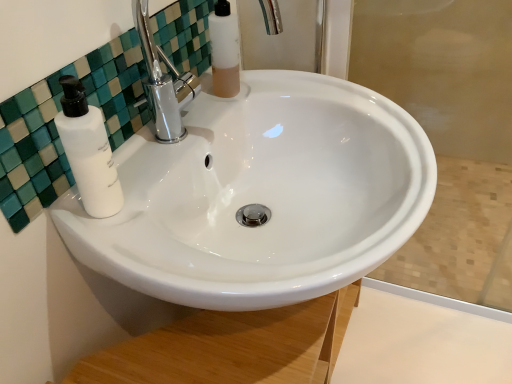
Image resolution: width=512 pixels, height=384 pixels. What do you see at coordinates (261, 195) in the screenshot?
I see `white glossy sink at center` at bounding box center [261, 195].

This screenshot has width=512, height=384. Identify the location of white matte soap dispenser at left. (88, 151).

From a real-world perspective, is white glossy sink at center over white glossy sink at upper center?

No.

Who is shorter, white glossy sink at center or white glossy sink at upper center?

white glossy sink at upper center.

Is white glossy sink at center in front of white glossy sink at upper center?

Yes, white glossy sink at center is closer to the viewer.

Based on the photo, from the image's perspective, is white glossy sink at upper center above translucent plastic mouthwash at upper center?

Actually, white glossy sink at upper center appears below translucent plastic mouthwash at upper center in the image.

Considering the sizes of objects white glossy sink at upper center and translucent plastic mouthwash at upper center in the image provided, who is bigger, white glossy sink at upper center or translucent plastic mouthwash at upper center?

white glossy sink at upper center.

Who is shorter, white glossy sink at upper center or translucent plastic mouthwash at upper center?

white glossy sink at upper center.

Considering the relative sizes of white glossy sink at upper center and translucent plastic mouthwash at upper center in the image provided, is white glossy sink at upper center thinner than translucent plastic mouthwash at upper center?

Yes, white glossy sink at upper center is thinner than translucent plastic mouthwash at upper center.

Does white glossy sink at center have a greater width compared to translucent plastic mouthwash at upper center?

Indeed, white glossy sink at center has a greater width compared to translucent plastic mouthwash at upper center.

In the scene shown: From the image's perspective, is white glossy sink at center under translucent plastic mouthwash at upper center?

Indeed, from the image's perspective, white glossy sink at center is shown beneath translucent plastic mouthwash at upper center.

Considering the relative sizes of white glossy sink at center and translucent plastic mouthwash at upper center in the image provided, is white glossy sink at center taller than translucent plastic mouthwash at upper center?

Correct, white glossy sink at center is much taller as translucent plastic mouthwash at upper center.

Identify the location of soap dispenser behind the white glossy sink at upper center. (88, 151).

From the image's perspective, is white glossy sink at upper center located above white matte soap dispenser at left?

Indeed, from the image's perspective, white glossy sink at upper center is shown above white matte soap dispenser at left.

Considering the sizes of white glossy sink at upper center and white matte soap dispenser at left in the image, is white glossy sink at upper center bigger or smaller than white matte soap dispenser at left?

white glossy sink at upper center is bigger than white matte soap dispenser at left.

Is point (133, 66) in front of point (85, 155)?

No.

In the scene shown: From the image's perspective, which object appears higher, white matte soap dispenser at left or white glossy sink at center?

white matte soap dispenser at left, from the image's perspective.

Between white matte soap dispenser at left and white glossy sink at center, which one appears on the left side from the viewer's perspective?

white matte soap dispenser at left.

Does point (101, 134) come farther from viewer compared to point (374, 132)?

No, it is not.

Between translucent plastic mouthwash at upper center and white matte soap dispenser at left, which one has smaller size?

white matte soap dispenser at left.

Is translucent plastic mouthwash at upper center completely or partially outside of white matte soap dispenser at left?

Yes, translucent plastic mouthwash at upper center is outside of white matte soap dispenser at left.

Is translucent plastic mouthwash at upper center facing away from white matte soap dispenser at left?

No, translucent plastic mouthwash at upper center is not facing the opposite direction of white matte soap dispenser at left.

Is point (219, 75) positioned after point (98, 131)?

Yes, point (219, 75) is farther from viewer.

Between white matte soap dispenser at left and white glossy sink at upper center, which one is positioned behind?

white matte soap dispenser at left is further from the camera.

Could you tell me if white matte soap dispenser at left is turned towards white glossy sink at upper center?

No, white matte soap dispenser at left does not turn towards white glossy sink at upper center.

Considering the relative sizes of white matte soap dispenser at left and white glossy sink at upper center in the image provided, is white matte soap dispenser at left smaller than white glossy sink at upper center?

Yes.

Who is taller, white matte soap dispenser at left or white glossy sink at upper center?

white matte soap dispenser at left is taller.

Find the location of `sink below the white glossy sink at upper center (from the image's perspective)`. sink below the white glossy sink at upper center (from the image's perspective) is located at coordinates (261, 195).

Where is `mouthwash lying above the white glossy sink at upper center (from the image's perspective)`? mouthwash lying above the white glossy sink at upper center (from the image's perspective) is located at coordinates (224, 50).

Estimate the real-world distances between objects in this image. Which object is closer to translucent plastic mouthwash at upper center, white glossy sink at upper center or white matte soap dispenser at left?

white glossy sink at upper center is closer to translucent plastic mouthwash at upper center.

Looking at the image, which one is located further to translucent plastic mouthwash at upper center, white matte soap dispenser at left or white glossy sink at center?

Based on the image, white matte soap dispenser at left appears to be further to translucent plastic mouthwash at upper center.

Estimate the real-world distances between objects in this image. Which object is further from white glossy sink at upper center, white matte soap dispenser at left or translucent plastic mouthwash at upper center?

translucent plastic mouthwash at upper center.

Estimate the real-world distances between objects in this image. Which object is further from white glossy sink at upper center, translucent plastic mouthwash at upper center or white matte soap dispenser at left?

Based on the image, translucent plastic mouthwash at upper center appears to be further to white glossy sink at upper center.

From the picture: Based on their spatial positions, is white glossy sink at upper center or white glossy sink at center closer to white matte soap dispenser at left?

white glossy sink at upper center is positioned closer to the anchor white matte soap dispenser at left.

Looking at the image, which one is located further to white glossy sink at center, white glossy sink at upper center or translucent plastic mouthwash at upper center?

translucent plastic mouthwash at upper center lies further to white glossy sink at center than the other object.

From the image, which object appears to be nearer to white glossy sink at center, white matte soap dispenser at left or white glossy sink at upper center?

white glossy sink at upper center.

From the image, which object appears to be farther from translucent plastic mouthwash at upper center, white glossy sink at center or white glossy sink at upper center?

white glossy sink at center.

The width and height of the screenshot is (512, 384). Find the location of `soap dispenser between translucent plastic mouthwash at upper center and white glossy sink at center from top to bottom`. soap dispenser between translucent plastic mouthwash at upper center and white glossy sink at center from top to bottom is located at coordinates (88, 151).

The image size is (512, 384). I want to click on soap dispenser located between white glossy sink at upper center and translucent plastic mouthwash at upper center in the depth direction, so click(x=88, y=151).

Identify the location of mirror between translucent plastic mouthwash at upper center and white glossy sink at center from top to bottom. This screenshot has width=512, height=384. (55, 129).

Find the location of a particular element. The height and width of the screenshot is (384, 512). soap dispenser between white glossy sink at upper center and white glossy sink at center in the up-down direction is located at coordinates (88, 151).